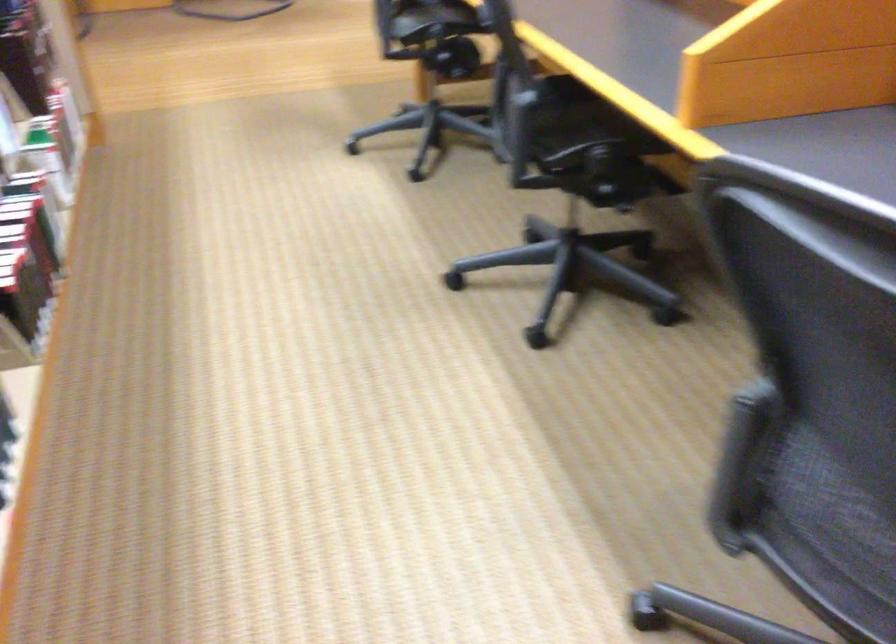
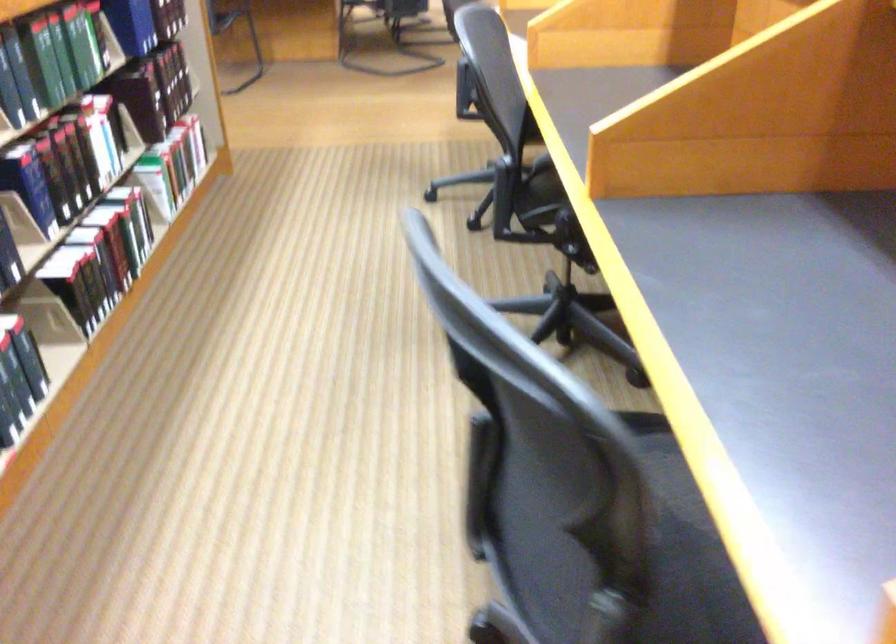
Question: How did the camera likely rotate?

Choices:
 (A) Left
 (B) Right
 (C) Up
 (D) Down

Answer: (A)